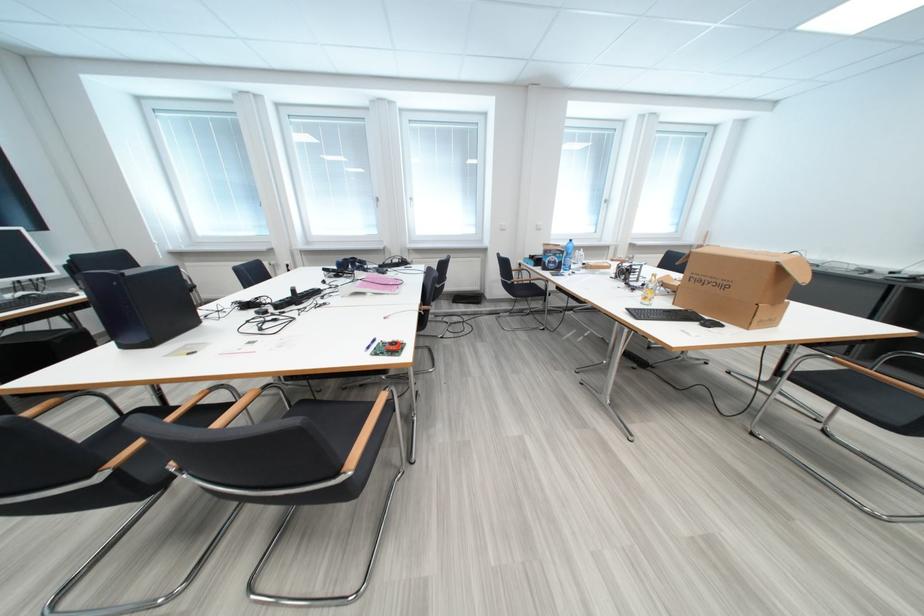
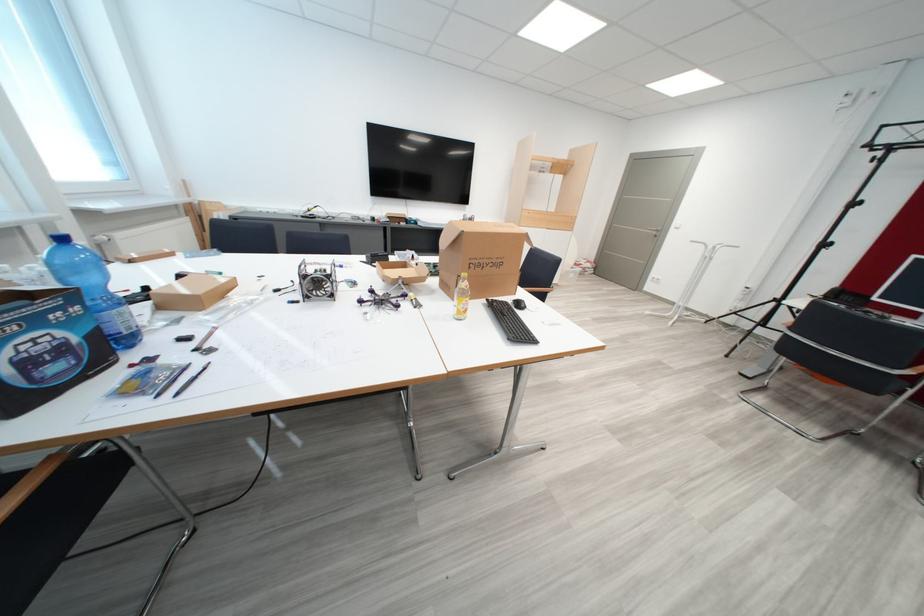
Locate, in the second image, the point that corresponds to pixel 565 257 in the first image.

(46, 323)